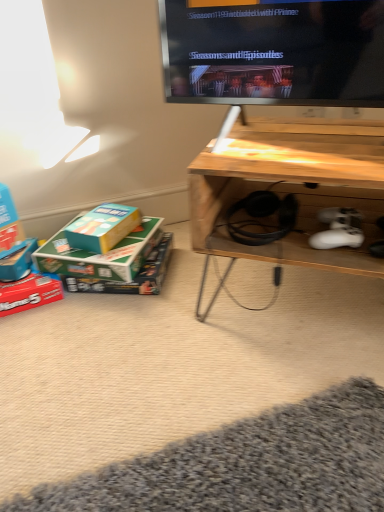
This screenshot has width=384, height=512. I want to click on vacant area that is in front of wooden desk at lower right, so click(269, 398).